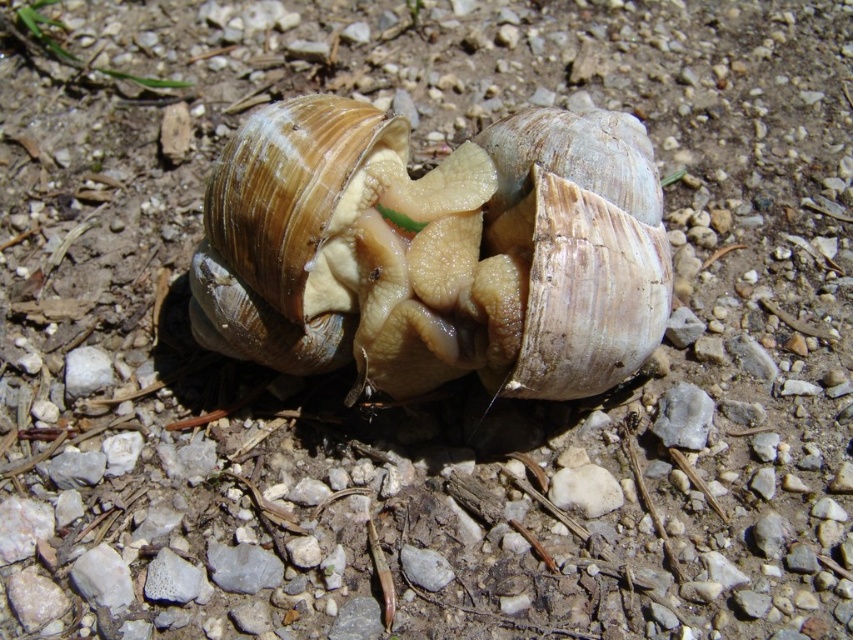
You are a nature photographer observing two snails on a forest floor. You notice the brown textured shell at center and the matte brown shell at center. Which snail is positioned higher in the image?

The brown textured shell at center is located above the matte brown shell at center, so it is positioned higher in the image.

You are a photographer taking a picture of the two snails at the points point (206, 273) and point (541, 372). Which point is closer to your camera lens?

Point (206, 273) is closer to the camera lens because it is further to the viewer than point (541, 372).

You are a researcher studying snail behavior. You observe two snails with brown textured shell at center. How far apart are they?

The two snails with brown textured shell at center are 98.54 centimeters apart.